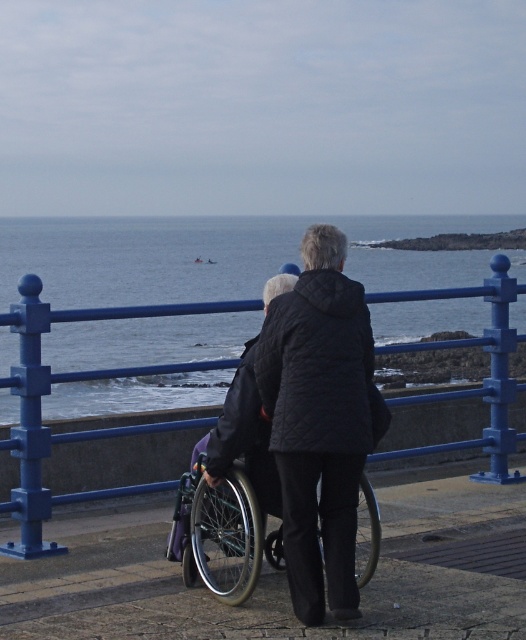
Question: Is blue water at center thinner than black quilted jacket at center?

Choices:
 (A) no
 (B) yes

Answer: (A)

Question: Does blue water at center lie in front of silver metallic wheelchair at center?

Choices:
 (A) yes
 (B) no

Answer: (B)

Question: Which of the following is the farthest from the observer?

Choices:
 (A) (55, 417)
 (B) (270, 557)
 (C) (327, 292)

Answer: (A)

Question: Which point is farther to the camera?

Choices:
 (A) black quilted jacket at center
 (B) blue water at center

Answer: (B)

Question: Does blue water at center have a lesser width compared to black quilted jacket at center?

Choices:
 (A) no
 (B) yes

Answer: (A)

Question: Which is farther from the silver metallic wheelchair at center?

Choices:
 (A) black quilted jacket at center
 (B) blue water at center

Answer: (B)